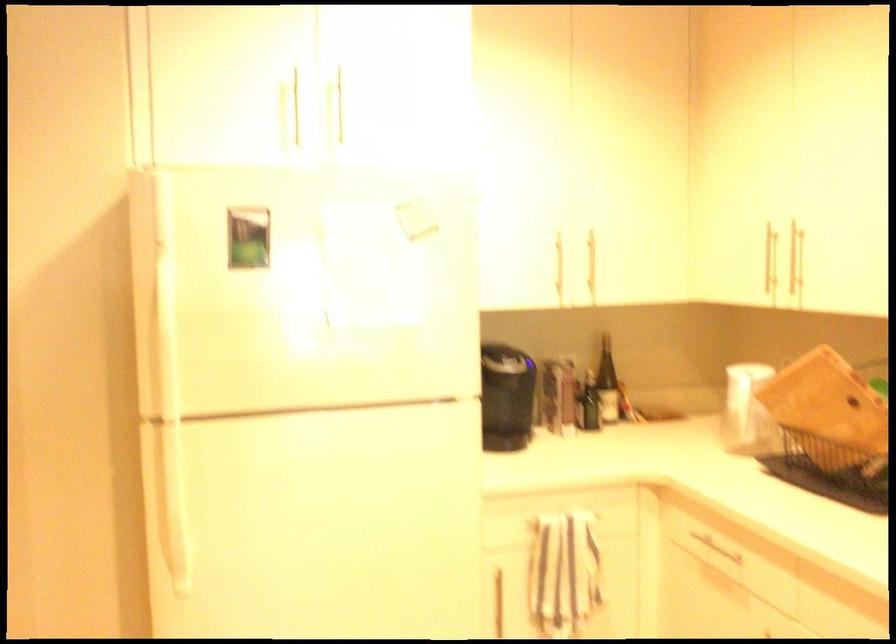
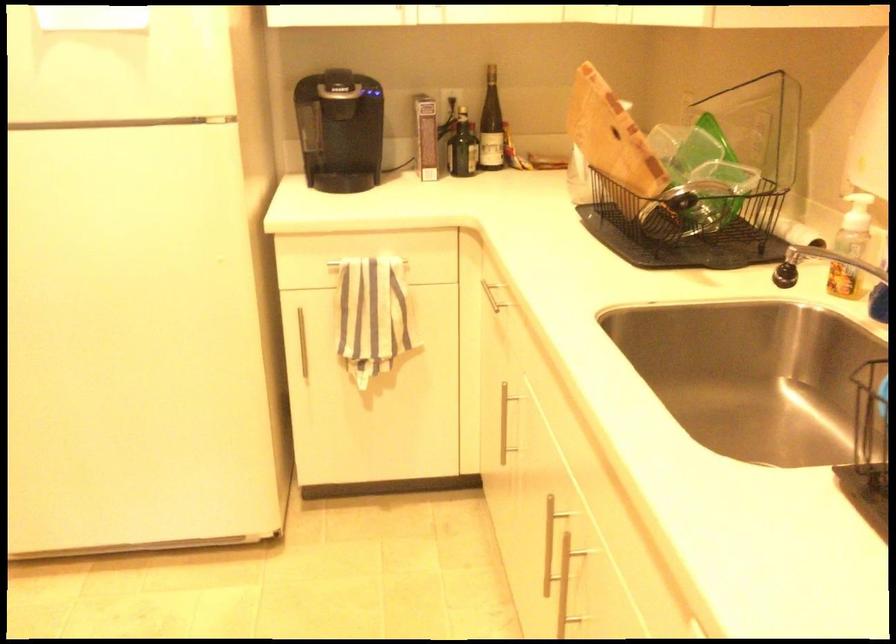
Question: The images are taken continuously from a first-person perspective. In which direction are you moving?

Choices:
 (A) Left
 (B) Right
 (C) Forward
 (D) Backward

Answer: (B)